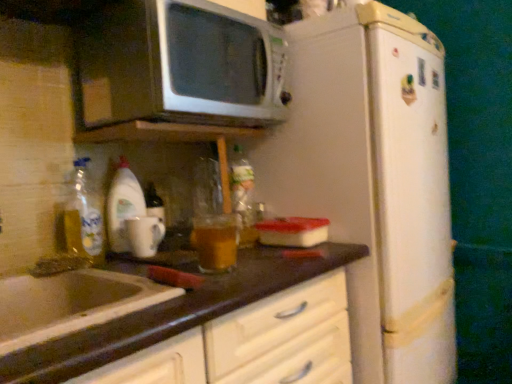
In order to face white matte refrigerator at center-right, should I rotate leftwards or rightwards?

It's best to rotate right around 12.498 degrees.

You are a GUI agent. You are given a task and a screenshot of the screen. Output one action in this format:
    pyautogui.click(x=<x>, y=<y>)
    Task: Click on the brown laminate countertop at lower center
    The width and height of the screenshot is (512, 384).
    Given the screenshot: What is the action you would take?
    pyautogui.click(x=172, y=314)

Identify the location of white matte refrigerator at center-right. (374, 181).

Are translucent plastic bottle at center and white glossy mug at left beside each other?

translucent plastic bottle at center and white glossy mug at left are not in contact.

How many degrees apart are the facing directions of translucent plastic bottle at center and white glossy mug at left?

The angular difference between translucent plastic bottle at center and white glossy mug at left is 5.79 degrees.

Which of these two, translucent plastic bottle at center or white glossy mug at left, is wider?

Wider between the two is white glossy mug at left.

From a real-world perspective, is translucent plastic bottle at center positioned above or below white glossy mug at left?

translucent plastic bottle at center is above white glossy mug at left.

Does translucent glass mug at left appear on the left side of white glossy mug at left?

Yes, translucent glass mug at left is to the left of white glossy mug at left.

Find the location of a particular element. This screenshot has height=384, width=512. beverage behind the white glossy mug at left is located at coordinates (123, 206).

Considering the relative sizes of translucent glass mug at left and white glossy mug at left in the image provided, is translucent glass mug at left wider than white glossy mug at left?

Correct, the width of translucent glass mug at left exceeds that of white glossy mug at left.

From a real-world perspective, who is located lower, translucent plastic bottle at center or translucent glass mug at left?

translucent glass mug at left, from a real-world perspective.

In terms of size, does translucent plastic bottle at center appear bigger or smaller than translucent glass mug at left?

translucent plastic bottle at center is smaller than translucent glass mug at left.

Based on the photo, which object is thinner, translucent plastic bottle at center or translucent glass mug at left?

With smaller width is translucent plastic bottle at center.

In the scene shown: How many degrees apart are the facing directions of translucent plastic bottle at center and translucent glass mug at left?

The angular difference between translucent plastic bottle at center and translucent glass mug at left is 0.954 degrees.

Based on the photo, is translucent plastic bottle at center further to the viewer compared to brown laminate countertop at lower center?

Yes, translucent plastic bottle at center is behind brown laminate countertop at lower center.

Which point is more distant from viewer, (234,179) or (70,377)?

Positioned behind is point (234,179).

Which of these two, translucent plastic bottle at center or brown laminate countertop at lower center, is wider?

brown laminate countertop at lower center is wider.

The width and height of the screenshot is (512, 384). What are the coordinates of `bottle above the brown laminate countertop at lower center (from a real-world perspective)` in the screenshot? It's located at (243, 197).

Is white glossy microwave at upper center inside the boundaries of white glossy sink at lower left, or outside?

white glossy microwave at upper center is not enclosed by white glossy sink at lower left.

From the image's perspective, does white glossy microwave at upper center appear lower than white glossy sink at lower left?

No.

Who is shorter, white glossy microwave at upper center or white glossy sink at lower left?

white glossy sink at lower left.

Based on the photo, is translucent glass mug at left located within brown laminate countertop at lower center?

Actually, translucent glass mug at left is outside brown laminate countertop at lower center.

Are brown laminate countertop at lower center and translucent glass mug at left beside each other?

brown laminate countertop at lower center and translucent glass mug at left are clearly separated.

From the image's perspective, is brown laminate countertop at lower center under translucent glass mug at left?

Indeed, from the image's perspective, brown laminate countertop at lower center is shown beneath translucent glass mug at left.

Considering the relative sizes of brown laminate countertop at lower center and translucent glass mug at left in the image provided, is brown laminate countertop at lower center taller than translucent glass mug at left?

Yes.

Can you confirm if brown laminate countertop at lower center is taller than white glossy mug at left?

Correct, brown laminate countertop at lower center is much taller as white glossy mug at left.

In the scene shown: Is brown laminate countertop at lower center closer to the viewer compared to white glossy mug at left?

Yes, brown laminate countertop at lower center is closer to the camera.

Find the location of a particular element. The width and height of the screenshot is (512, 384). countertop that is below the white glossy mug at left (from the image's perspective) is located at coordinates (172, 314).

Based on their positions, is brown laminate countertop at lower center located to the left or right of white glossy mug at left?

Clearly, brown laminate countertop at lower center is on the right of white glossy mug at left in the image.

Identify the location of mug below the translucent plastic bottle at center (from the image's perspective). 144,235.

I want to click on mug in front of the translucent glass mug at left, so click(144, 235).

Which object lies further to the anchor point translucent plastic bottle at center, white glossy mug at left or translucent glass mug at left?

translucent glass mug at left is further to translucent plastic bottle at center.

Estimate the real-world distances between objects in this image. Which object is closer to translucent glass mug at left, white matte refrigerator at center-right or white glossy sink at lower left?

white glossy sink at lower left is closer to translucent glass mug at left.

Looking at this image, estimate the real-world distances between objects in this image. Which object is further from white glossy microwave at upper center, white matte refrigerator at center-right or brown laminate countertop at lower center?

brown laminate countertop at lower center is further to white glossy microwave at upper center.

Consider the image. Which object lies further to the anchor point white matte refrigerator at center-right, white glossy mug at left or white glossy sink at lower left?

white glossy sink at lower left.

Which object lies nearer to the anchor point translucent glass mug at left, white glossy microwave at upper center or white matte refrigerator at center-right?

Based on the image, white glossy microwave at upper center appears to be nearer to translucent glass mug at left.

From the image, which object appears to be nearer to translucent plastic bottle at center, translucent glass mug at left or white glossy mug at left?

white glossy mug at left lies closer to translucent plastic bottle at center than the other object.

From the image, which object appears to be nearer to white glossy sink at lower left, white glossy mug at left or translucent plastic bottle at center?

white glossy mug at left is positioned closer to the anchor white glossy sink at lower left.

Estimate the real-world distances between objects in this image. Which object is closer to white glossy sink at lower left, translucent glass mug at left or white glossy microwave at upper center?

translucent glass mug at left is closer to white glossy sink at lower left.

Identify the location of beverage that lies between white glossy microwave at upper center and white glossy mug at left from top to bottom. (123, 206).

This screenshot has height=384, width=512. I want to click on bottle between white glossy mug at left and white matte refrigerator at center-right from left to right, so click(243, 197).

At what (x,y) coordinates should I click in order to perform the action: click on refrigerator between brown laminate countertop at lower center and translucent glass mug at left in the front-back direction. Please return your answer as a coordinate pair (x, y). Looking at the image, I should click on (374, 181).

I want to click on mug between brown laminate countertop at lower center and translucent glass mug at left from front to back, so click(x=144, y=235).